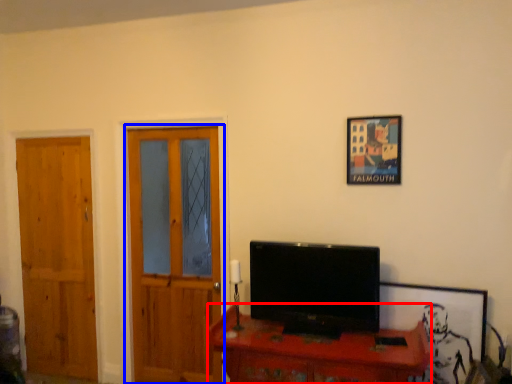
Question: Which object is further to the camera taking this photo, desk (highlighted by a red box) or door (highlighted by a blue box)?

Choices:
 (A) desk
 (B) door

Answer: (B)